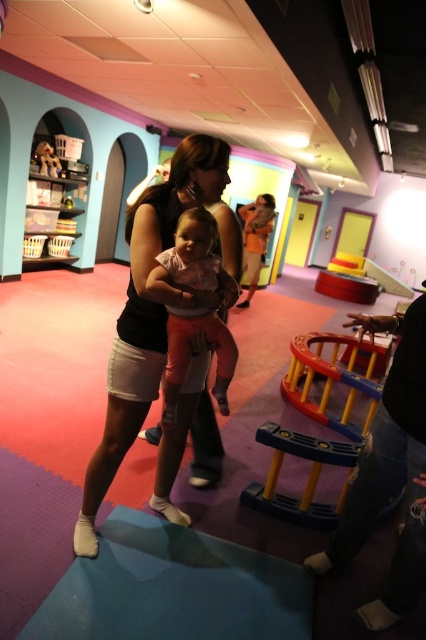
Question: Based on their relative distances, which object is nearer to the matte pink fabric baby at center?

Choices:
 (A) matte black tank top at center
 (B) wooden bear at upper left
 (C) matte black shirt at center

Answer: (A)

Question: In this image, where is matte black shirt at center located relative to wooden bear at upper left?

Choices:
 (A) right
 (B) left

Answer: (A)

Question: Is matte black tank top at center thinner than matte pink fabric baby at center?

Choices:
 (A) yes
 (B) no

Answer: (B)

Question: Which point is closer to the camera?

Choices:
 (A) (252, 220)
 (B) (161, 192)
 (C) (210, 273)

Answer: (B)

Question: Which of the following is the farthest from the observer?

Choices:
 (A) matte pink fabric baby at center
 (B) wooden bear at upper left

Answer: (B)

Question: Is matte black tank top at center above wooden bear at upper left?

Choices:
 (A) no
 (B) yes

Answer: (A)